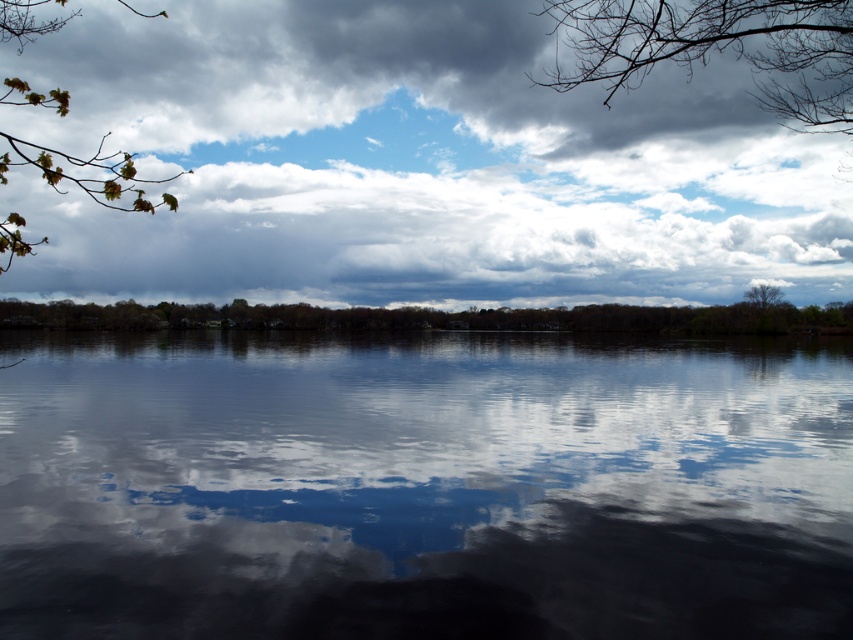
You are an observer standing at the lakeside. You notice the smooth dark water at center and the bare branches at upper center. Which object is closer to you?

The smooth dark water at center is closer to you because it is in front of the bare branches at upper center.

You are an artist planning to paint the lakeside scene. You need to decide which area to focus on first between the cloudy sky at upper center and the bare branches at upper center. Based on their sizes, which one should you start with to cover the larger area first?

The cloudy sky at upper center has a larger width than the bare branches at upper center, so you should start painting the cloudy sky at upper center first to cover the larger area.

You are an artist planning to paint this lakeside scene. You want to ensure the smooth dark water at center and the green matte tree at center are proportionally accurate. Which object should you make wider in your painting?

The green matte tree at center should be wider because the smooth dark water at center is narrower than the green matte tree at center according to the description.